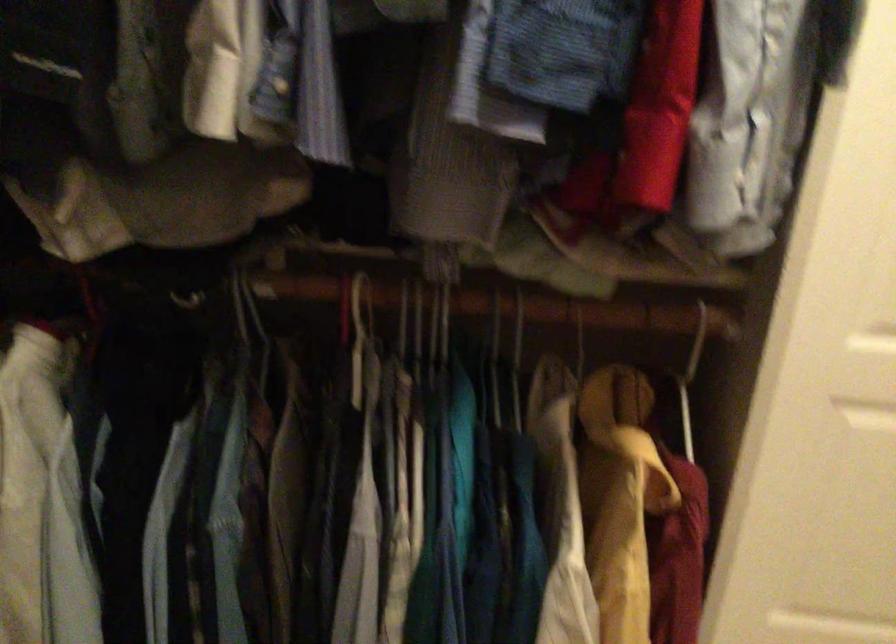
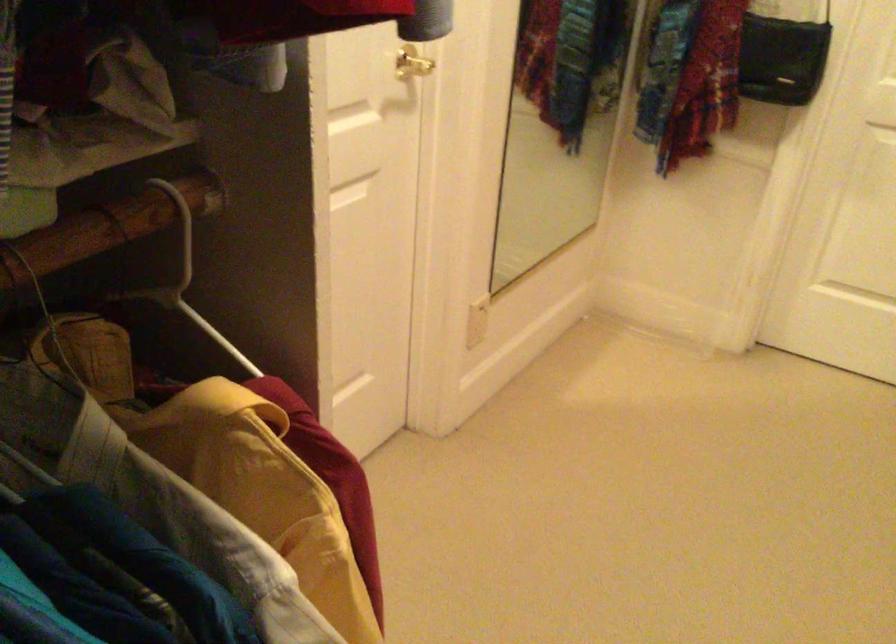
The first image is from the beginning of the video and the second image is from the end. How did the camera likely rotate when shooting the video?

The rotation direction of the camera is right-down.